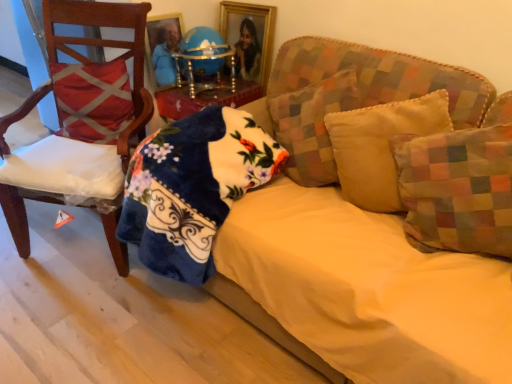
Question: Is yellow fabric pillow at center, arranged as the 2th pillow when viewed from the right, shorter than blue glossy globe at center?

Choices:
 (A) no
 (B) yes

Answer: (A)

Question: Does yellow fabric pillow at center, arranged as the third pillow when viewed from the left, lie behind blue glossy globe at center?

Choices:
 (A) yes
 (B) no

Answer: (B)

Question: Is blue glossy globe at center at the back of yellow fabric pillow at center, arranged as the third pillow when viewed from the left?

Choices:
 (A) no
 (B) yes

Answer: (A)

Question: Is yellow fabric pillow at center, arranged as the third pillow when viewed from the left, positioned before blue glossy globe at center?

Choices:
 (A) yes
 (B) no

Answer: (A)

Question: From the image's perspective, is yellow fabric pillow at center, arranged as the 2th pillow when viewed from the right, below blue glossy globe at center?

Choices:
 (A) yes
 (B) no

Answer: (A)

Question: In the image, is red fabric pillow at left, which ranks as the first pillow in left-to-right order, on the left side or the right side of gold/glass picture frame at upper center?

Choices:
 (A) left
 (B) right

Answer: (A)

Question: Considering the positions of point (118, 122) and point (233, 38), is point (118, 122) closer or farther from the camera than point (233, 38)?

Choices:
 (A) closer
 (B) farther

Answer: (A)

Question: Considering the positions of red fabric pillow at left, which is the 4th pillow in right-to-left order, and gold/glass picture frame at upper center in the image, is red fabric pillow at left, which is the 4th pillow in right-to-left order, wider or thinner than gold/glass picture frame at upper center?

Choices:
 (A) thin
 (B) wide

Answer: (B)

Question: In the image, is red fabric pillow at left, which is the 4th pillow in right-to-left order, positioned in front of or behind gold/glass picture frame at upper center?

Choices:
 (A) behind
 (B) front

Answer: (B)

Question: Based on their positions, is red fabric pillow at left, which ranks as the first pillow in left-to-right order, located to the left or right of fluffy blue blanket at lower left?

Choices:
 (A) right
 (B) left

Answer: (B)

Question: Considering the positions of red fabric pillow at left, which ranks as the first pillow in left-to-right order, and fluffy blue blanket at lower left in the image, is red fabric pillow at left, which ranks as the first pillow in left-to-right order, wider or thinner than fluffy blue blanket at lower left?

Choices:
 (A) wide
 (B) thin

Answer: (B)

Question: Considering the positions of point (71, 137) and point (227, 158), is point (71, 137) closer or farther from the camera than point (227, 158)?

Choices:
 (A) farther
 (B) closer

Answer: (A)

Question: Considering their positions, is red fabric pillow at left, which ranks as the first pillow in left-to-right order, located in front of or behind fluffy blue blanket at lower left?

Choices:
 (A) front
 (B) behind

Answer: (B)

Question: Based on their sizes in the image, would you say multicolored fabric pillow at right, the fourth pillow positioned from the left, is bigger or smaller than blue glossy globe at center?

Choices:
 (A) small
 (B) big

Answer: (B)

Question: Is multicolored fabric pillow at right, the fourth pillow positioned from the left, taller or shorter than blue glossy globe at center?

Choices:
 (A) tall
 (B) short

Answer: (A)